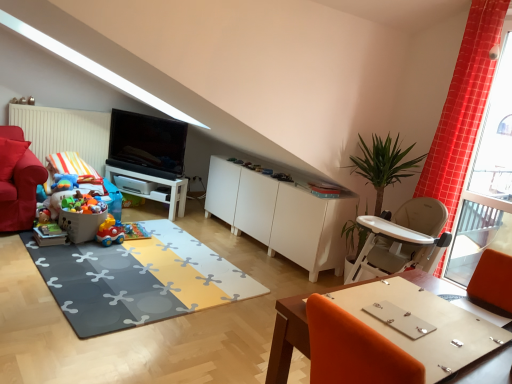
Question: Is plastic toy car at lower left, the second toy positioned from the top, surrounded by soft rubber mat at center?

Choices:
 (A) no
 (B) yes

Answer: (A)

Question: Does soft rubber mat at center turn towards plastic toy car at lower left, the second toy positioned from the top?

Choices:
 (A) no
 (B) yes

Answer: (A)

Question: Is the position of soft rubber mat at center more distant than that of plastic toy car at lower left, which is the 3th toy in bottom-to-top order?

Choices:
 (A) no
 (B) yes

Answer: (A)

Question: Can you confirm if soft rubber mat at center is thinner than plastic toy car at lower left, the second toy positioned from the top?

Choices:
 (A) yes
 (B) no

Answer: (B)

Question: Considering the relative positions of soft rubber mat at center and plastic toy car at lower left, the second toy positioned from the top, in the image provided, is soft rubber mat at center in front of plastic toy car at lower left, the second toy positioned from the top,?

Choices:
 (A) yes
 (B) no

Answer: (A)

Question: Looking at the image, does satin black tv at center seem bigger or smaller compared to velvet red armchair at left?

Choices:
 (A) big
 (B) small

Answer: (B)

Question: In the image, is satin black tv at center positioned in front of or behind velvet red armchair at left?

Choices:
 (A) behind
 (B) front

Answer: (A)

Question: In the image, is satin black tv at center on the left side or the right side of velvet red armchair at left?

Choices:
 (A) left
 (B) right

Answer: (B)

Question: From a real-world perspective, relative to velvet red armchair at left, is satin black tv at center vertically above or below?

Choices:
 (A) above
 (B) below

Answer: (A)

Question: From the image's perspective, is wooden table at lower right, which is the first table from right to left, above or below soft rubber mat at center?

Choices:
 (A) above
 (B) below

Answer: (B)

Question: Would you say wooden table at lower right, which is the 1th table in bottom-to-top order, is to the left or to the right of soft rubber mat at center in the picture?

Choices:
 (A) left
 (B) right

Answer: (B)

Question: Considering the positions of wooden table at lower right, placed as the 2th table when sorted from left to right, and soft rubber mat at center in the image, is wooden table at lower right, placed as the 2th table when sorted from left to right, wider or thinner than soft rubber mat at center?

Choices:
 (A) wide
 (B) thin

Answer: (B)

Question: From a real-world perspective, is wooden table at lower right, arranged as the second table when viewed from the top, physically located above or below soft rubber mat at center?

Choices:
 (A) above
 (B) below

Answer: (A)

Question: Looking at the image, does white matte cabinet at center seem bigger or smaller compared to matte plastic toy at lower left, positioned as the first toy in bottom-to-top order?

Choices:
 (A) small
 (B) big

Answer: (B)

Question: Is white matte cabinet at center in front of or behind matte plastic toy at lower left, acting as the fourth toy starting from the top, in the image?

Choices:
 (A) front
 (B) behind

Answer: (A)